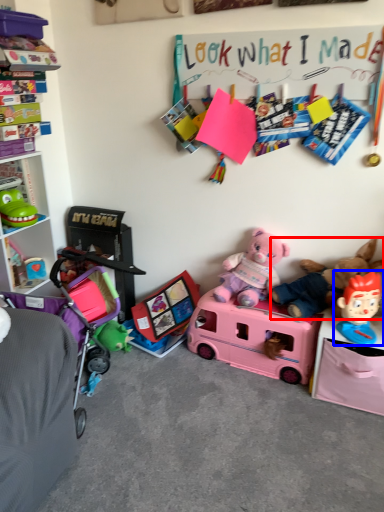
Question: Which object is further to the camera taking this photo, teddy bear (highlighted by a red box) or toy (highlighted by a blue box)?

Choices:
 (A) teddy bear
 (B) toy

Answer: (A)